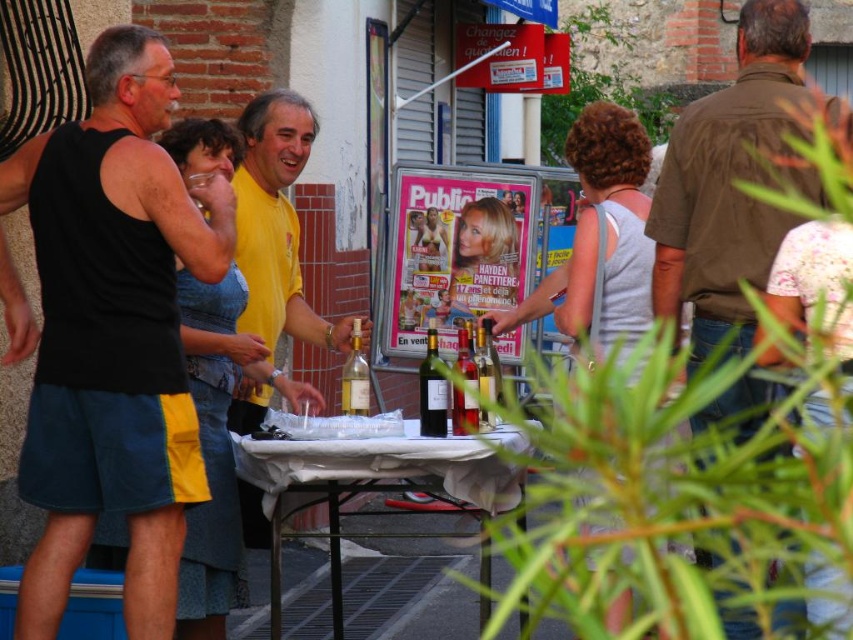
Question: Based on their relative distances, which object is nearer to the translucent glass wine bottle at center?

Choices:
 (A) denim skirt at center
 (B) white cloth-covered table at center
 (C) gray tank top at center

Answer: (C)

Question: Can you confirm if yellow cotton shirt at center is positioned to the right of translucent glass wine bottle at center?

Choices:
 (A) yes
 (B) no

Answer: (B)

Question: Among these objects, which one is farthest from the camera?

Choices:
 (A) denim skirt at center
 (B) yellow cotton shirt at center
 (C) dark green glass bottle at center
 (D) white cloth-covered table at center

Answer: (D)

Question: Is yellow cotton shirt at center above translucent glass bottle at center?

Choices:
 (A) yes
 (B) no

Answer: (A)

Question: Can you confirm if black fabric tank top at left is smaller than gray tank top at center?

Choices:
 (A) no
 (B) yes

Answer: (B)

Question: Which point appears closest to the camera in this image?

Choices:
 (A) (471, 490)
 (B) (759, 291)
 (C) (442, 374)

Answer: (A)